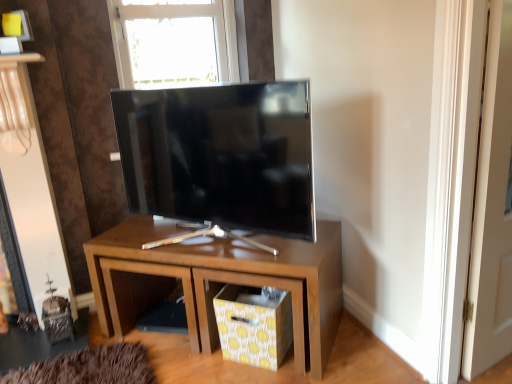
You are a GUI agent. You are given a task and a screenshot of the screen. Output one action in this format:
    pyautogui.click(x=<x>, y=<y>)
    Task: Click on the blank space situated above yellow dotted fabric drawer at lower center (from a real-world perspective)
    
    Given the screenshot: What is the action you would take?
    pyautogui.click(x=245, y=296)